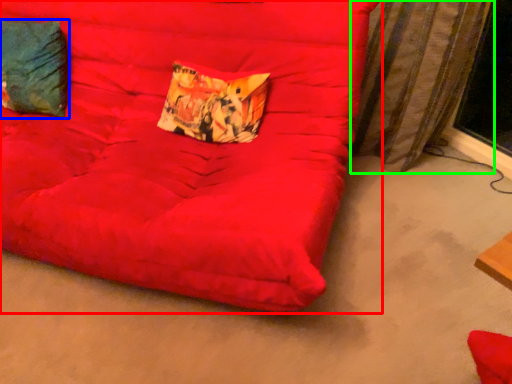
Question: Estimate the real-world distances between objects in this image. Which object is closer to furniture (highlighted by a red box), pillow (highlighted by a blue box) or curtain (highlighted by a green box)?

Choices:
 (A) pillow
 (B) curtain

Answer: (A)